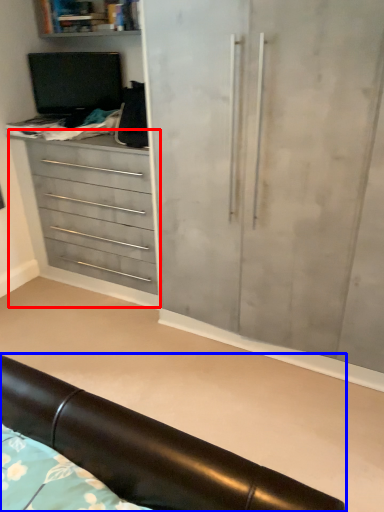
Question: Among these objects, which one is farthest to the camera, chest of drawers (highlighted by a red box) or furniture (highlighted by a blue box)?

Choices:
 (A) chest of drawers
 (B) furniture

Answer: (A)